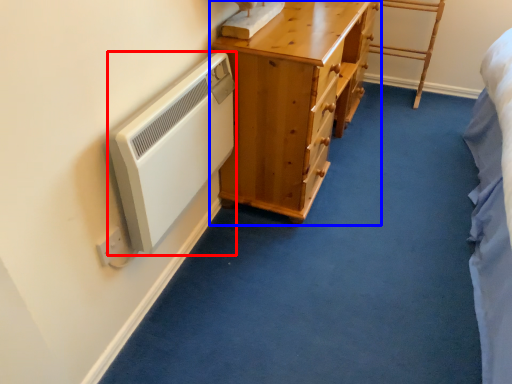
Question: Which of the following is the farthest to the observer, appliance (highlighted by a red box) or chest of drawers (highlighted by a blue box)?

Choices:
 (A) appliance
 (B) chest of drawers

Answer: (B)